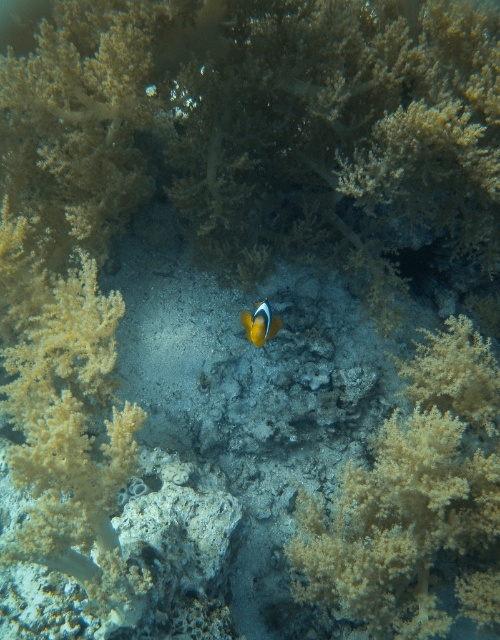
Does soft yellow coral at left have a smaller size compared to orange matte fish at center?

Actually, soft yellow coral at left might be larger than orange matte fish at center.

Does point (21, 548) come closer to viewer compared to point (278, 320)?

That is True.

At what (x,y) coordinates should I click in order to perform the action: click on soft yellow coral at left. Please return your answer as a coordinate pair (x, y). This screenshot has height=640, width=500. Looking at the image, I should click on (72, 438).

You are a GUI agent. You are given a task and a screenshot of the screen. Output one action in this format:
    pyautogui.click(x=<x>, y=<y>)
    Task: Click on the soft yellow coral at left
    
    Given the screenshot: What is the action you would take?
    pyautogui.click(x=72, y=438)

Does translucent yellow coral at center come in front of orange matte fish at center?

Yes, it is in front of orange matte fish at center.

In the scene shown: Is translucent yellow coral at center bigger than orange matte fish at center?

Indeed, translucent yellow coral at center has a larger size compared to orange matte fish at center.

The height and width of the screenshot is (640, 500). What do you see at coordinates (410, 493) in the screenshot? I see `translucent yellow coral at center` at bounding box center [410, 493].

Locate an element on the screen. translucent yellow coral at center is located at coordinates (410, 493).

Is translucent yellow coral at center bigger than soft yellow coral at left?

Incorrect, translucent yellow coral at center is not larger than soft yellow coral at left.

In the scene shown: Is translucent yellow coral at center below soft yellow coral at left?

Indeed, translucent yellow coral at center is positioned under soft yellow coral at left.

Consider the image. Who is more forward, (439, 456) or (143, 582)?

Point (143, 582) is in front.

You are a GUI agent. You are given a task and a screenshot of the screen. Output one action in this format:
    pyautogui.click(x=<x>, y=<y>)
    Task: Click on the translucent yellow coral at center
    This screenshot has height=640, width=500.
    Given the screenshot: What is the action you would take?
    pyautogui.click(x=410, y=493)